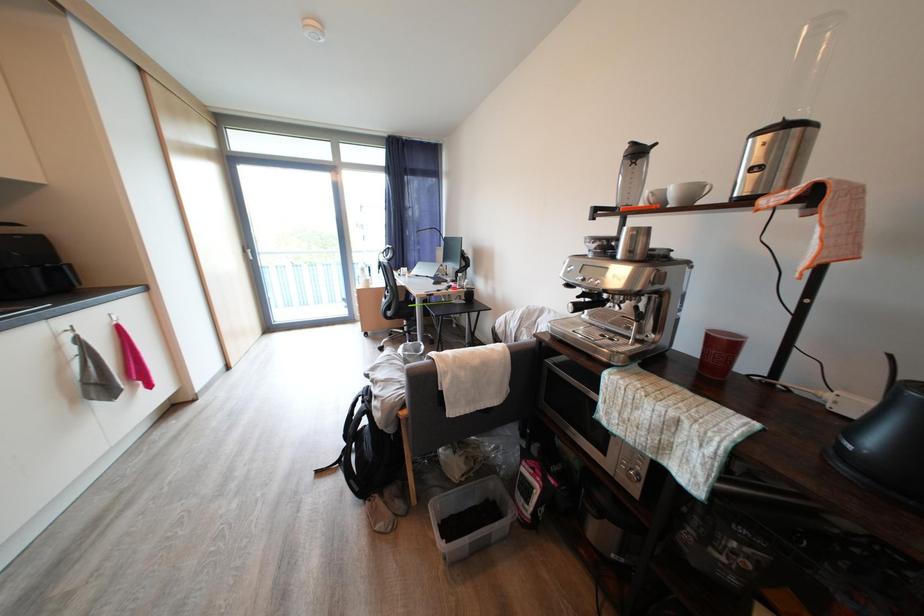
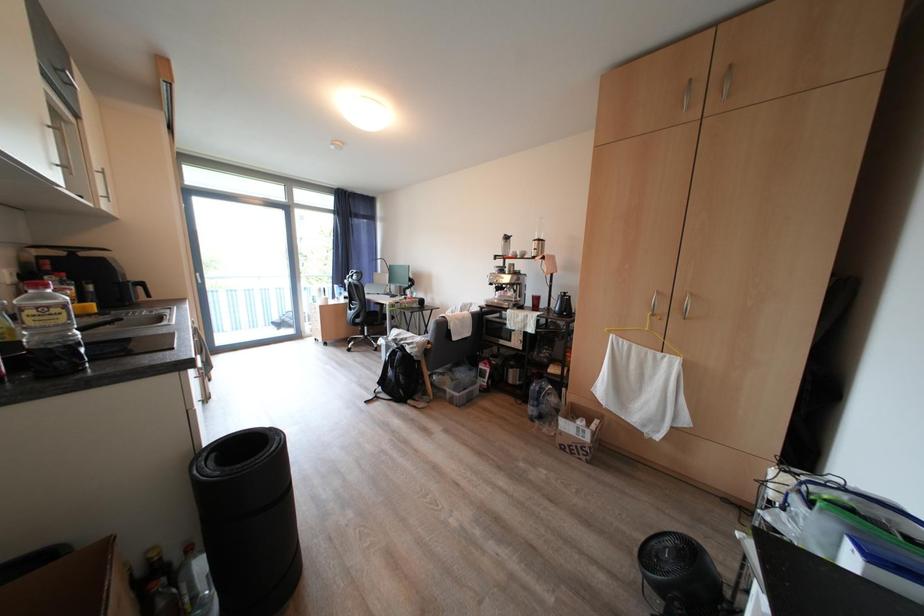
The images are taken continuously from a first-person perspective. In which direction are you moving?

The movement direction of the cameraman is left, backward.